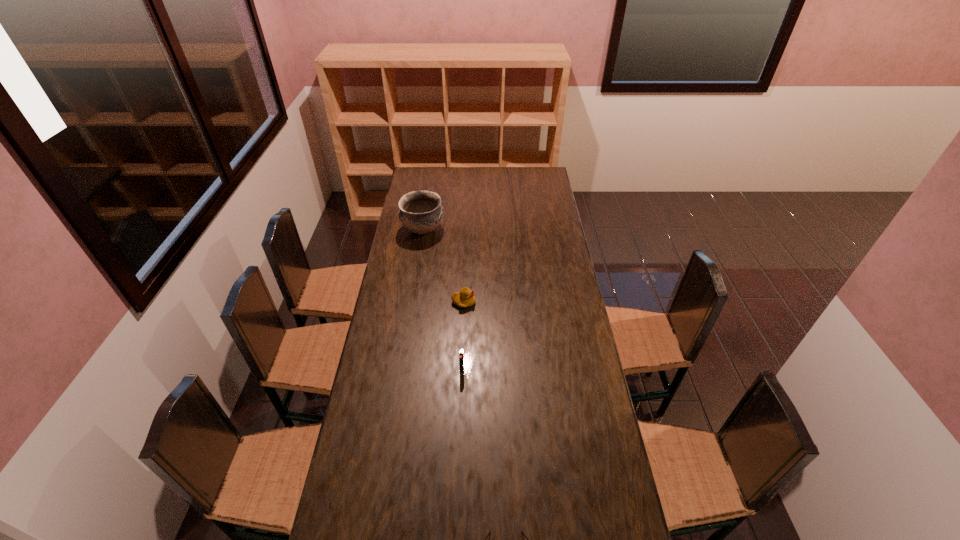
You are a GUI agent. You are given a task and a screenshot of the screen. Output one action in this format:
    pyautogui.click(x=<x>, y=<y>)
    Task: Click on the blank space at the far edge of the desktop
    
    Given the screenshot: What is the action you would take?
    pyautogui.click(x=440, y=171)

This screenshot has height=540, width=960. In the image, there is a desktop. Identify the location of vacant space at the left edge. (353, 463).

The width and height of the screenshot is (960, 540). I want to click on free space at the right edge of the desktop, so (x=573, y=302).

In the image, there is a desktop. Where is `vacant space at the far left corner`? The width and height of the screenshot is (960, 540). vacant space at the far left corner is located at coordinates (421, 180).

In the image, there is a desktop. Where is `vacant space at the far right corner`? The width and height of the screenshot is (960, 540). vacant space at the far right corner is located at coordinates (546, 185).

Locate an element on the screen. This screenshot has height=540, width=960. blank region between the second farthest object and the pottery is located at coordinates (444, 266).

You are a GUI agent. You are given a task and a screenshot of the screen. Output one action in this format:
    pyautogui.click(x=<x>, y=<y>)
    Task: Click on the free space between the second farthest object and the leftmost object
    The image size is (960, 540).
    Given the screenshot: What is the action you would take?
    pyautogui.click(x=444, y=266)

Select which object is the closest to the third shortest object. Please provide its 2D coordinates. Your answer should be formatted as a tuple, i.e. [(x, y)], where the tuple contains the x and y coordinates of a point satisfying the conditions above.

[(465, 297)]

I want to click on object that is the closest to the third farthest object, so click(465, 297).

At what (x,y) coordinates should I click in order to perform the action: click on vacant area in the image that satisfies the following two spatial constraints: 1. on the front-facing side of the third farthest object; 2. on the right side of the third nearest object. Please return your answer as a coordinate pair (x, y). The image size is (960, 540). Looking at the image, I should click on (461, 370).